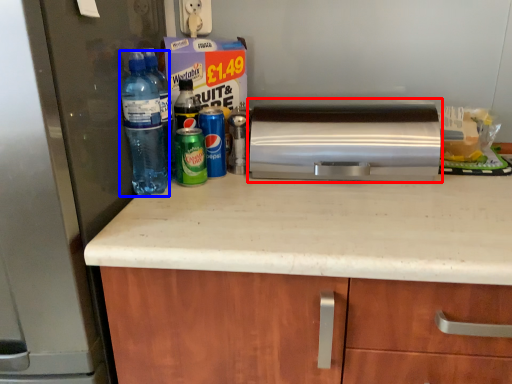
Question: Which object is closer to the camera taking this photo, home appliance (highlighted by a red box) or bottle (highlighted by a blue box)?

Choices:
 (A) home appliance
 (B) bottle

Answer: (B)